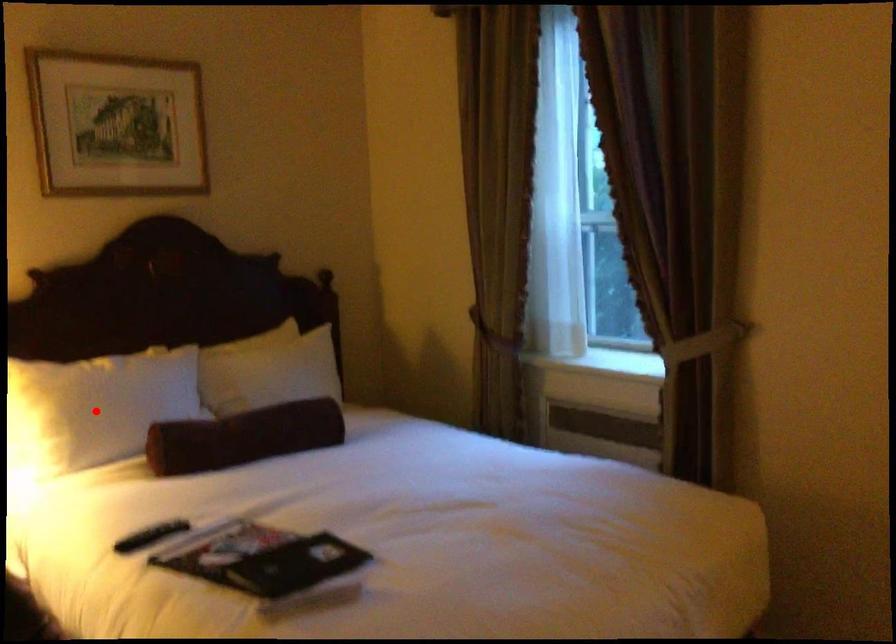
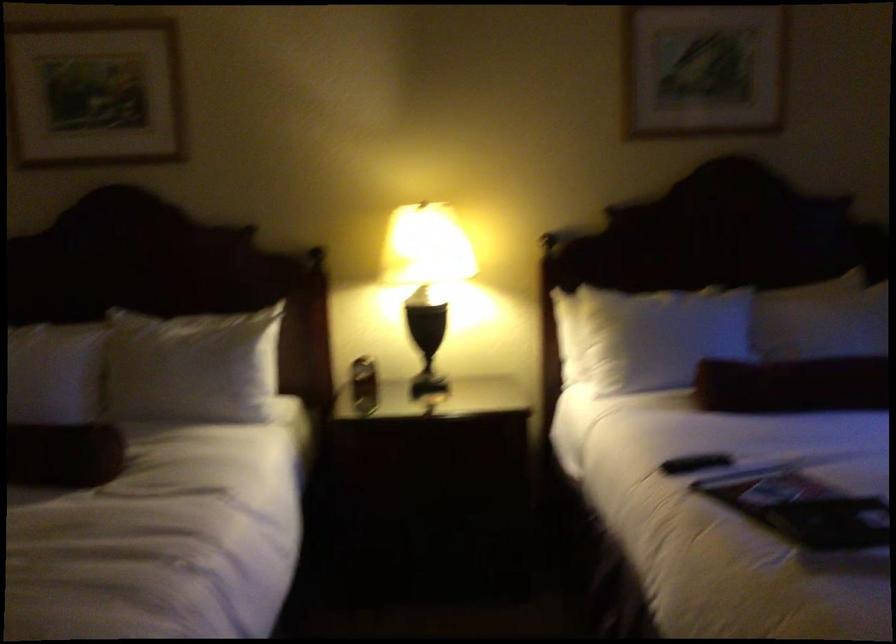
In the second image, find the point that corresponds to the highlighted location in the first image.

(652, 337)